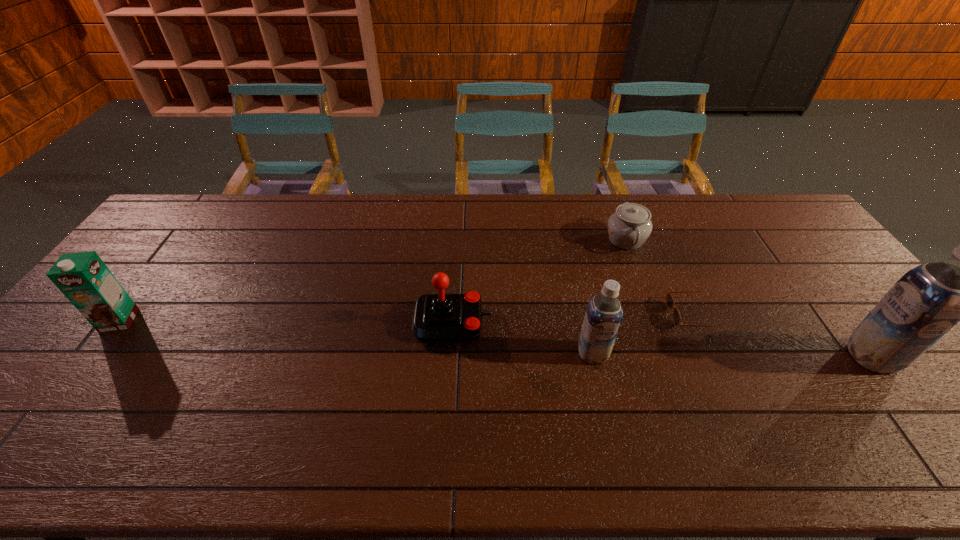
At what (x,y) coordinates should I click in order to perform the action: click on the fourth object from right to left. Please return your answer as a coordinate pair (x, y). The image size is (960, 540). Looking at the image, I should click on (603, 316).

At what (x,y) coordinates should I click in order to perform the action: click on the shorter soya milk. Please return your answer as a coordinate pair (x, y). This screenshot has width=960, height=540. Looking at the image, I should click on (603, 316).

Find the location of a particular element. The height and width of the screenshot is (540, 960). the right soya milk is located at coordinates (923, 305).

The width and height of the screenshot is (960, 540). I want to click on the tallest object, so click(x=923, y=305).

The height and width of the screenshot is (540, 960). Find the location of `chinaware`. chinaware is located at coordinates (629, 227).

Image resolution: width=960 pixels, height=540 pixels. What are the coordinates of `the second shortest object` in the screenshot? It's located at (629, 227).

Locate an element on the screen. This screenshot has width=960, height=540. the shortest object is located at coordinates (677, 320).

Identify the location of carton. The width and height of the screenshot is (960, 540). (83, 277).

Find the location of a particular element. The image size is (960, 540). the fourth tallest object is located at coordinates (437, 317).

Find the location of a particular element. the second object from left to right is located at coordinates (437, 317).